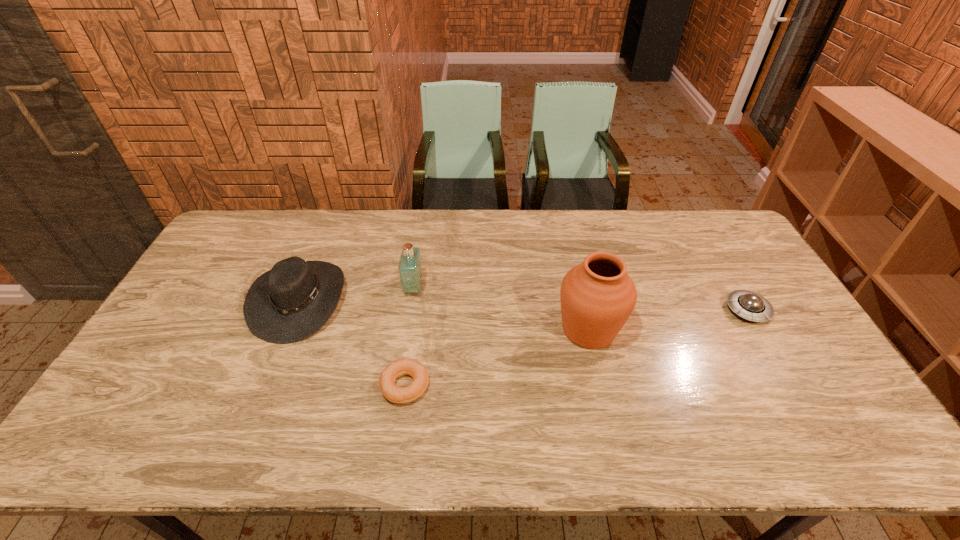
This screenshot has height=540, width=960. Find the location of `free space located on the front label of the fourth shortest object`. free space located on the front label of the fourth shortest object is located at coordinates (546, 288).

The image size is (960, 540). I want to click on vacant region located on the front-facing side of the leftmost object, so click(x=391, y=300).

Find the location of `free space located on the left of the second shortest object`. free space located on the left of the second shortest object is located at coordinates (709, 310).

The image size is (960, 540). In order to click on free region located 0.330m on the back of the shortest object in this screenshot , I will do `click(420, 280)`.

Find the location of a particular element. The image size is (960, 540). object that is at the right edge is located at coordinates (749, 305).

This screenshot has width=960, height=540. What are the coordinates of `free space at the far edge of the desktop` in the screenshot? It's located at (484, 232).

At what (x,y) coordinates should I click in order to perform the action: click on vacant space at the left edge of the desktop. Please return your answer as a coordinate pair (x, y). Looking at the image, I should click on (190, 373).

In the image, there is a desktop. Identify the location of free space at the right edge. (752, 333).

Locate an element on the screen. The image size is (960, 540). vacant region at the far right corner of the desktop is located at coordinates (699, 230).

In the image, there is a desktop. At what (x,y) coordinates should I click in order to perform the action: click on free space at the near right corner. Please return your answer as a coordinate pair (x, y). This screenshot has width=960, height=540. Looking at the image, I should click on (804, 432).